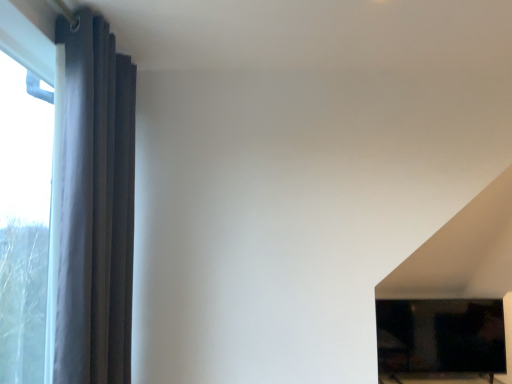
Locate an element on the screen. matte black curtain at left is located at coordinates (92, 206).

What is the approximate height of matte black curtain at left?

matte black curtain at left is 1.48 meters in height.

Image resolution: width=512 pixels, height=384 pixels. Describe the element at coordinates (92, 206) in the screenshot. I see `matte black curtain at left` at that location.

Find the location of a particular element. The image size is (512, 384). matte black curtain at left is located at coordinates (92, 206).